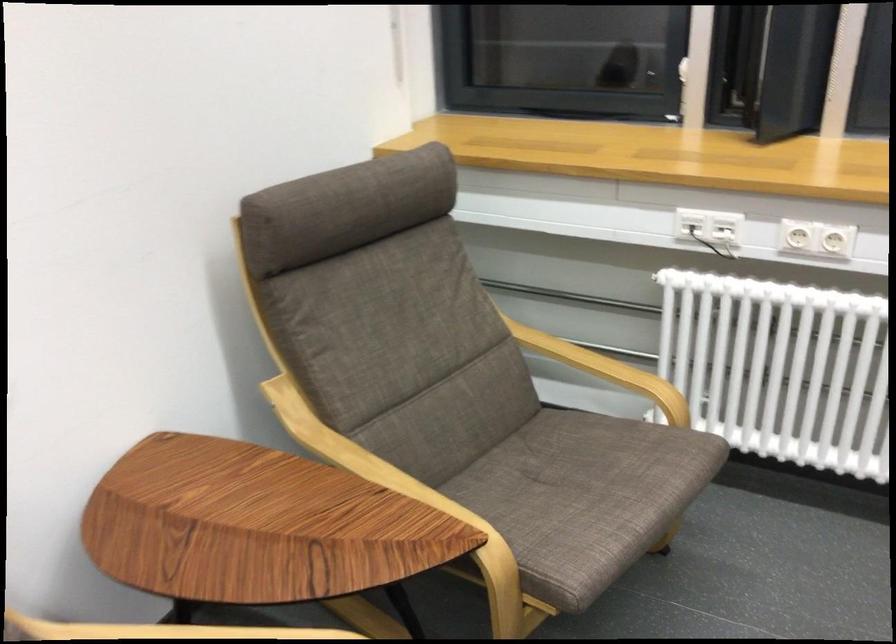
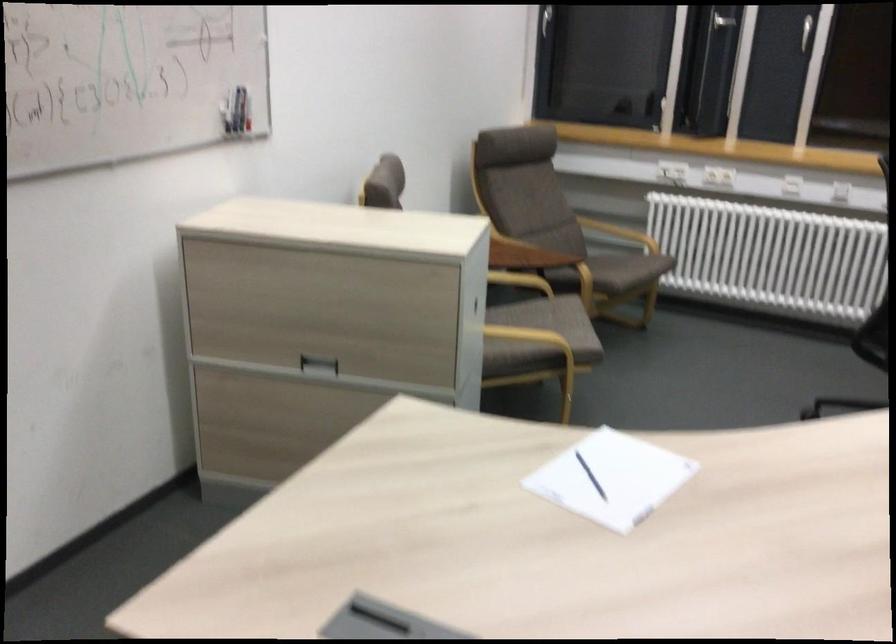
In the second image, find the point that corresponds to (547,576) in the first image.

(618, 270)